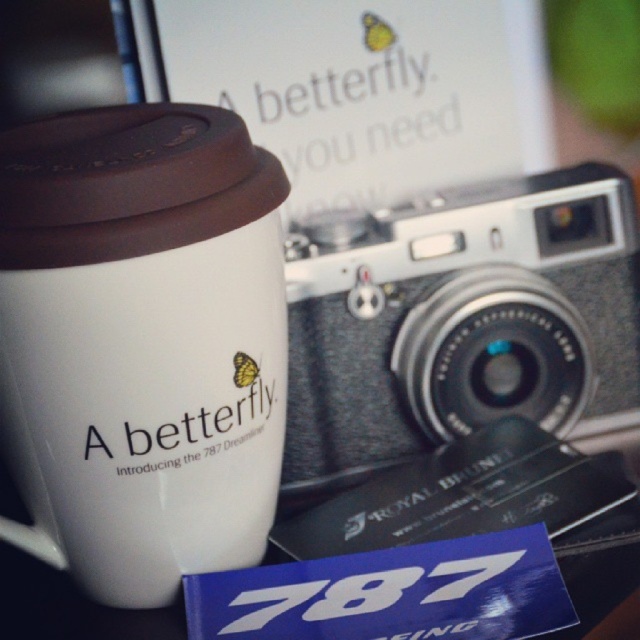
You are organizing items on a shelf and need to place both the white matte mug at left and the silver textured film camera at center. If the shelf has limited space, which item should you place first to ensure both fit?

The white matte mug at left has a smaller width than the silver textured film camera at center, so place the camera first to accommodate its larger size, then the mug will fit alongside it.

You are organizing items on a desk and need to place a new object at coordinate point 0.5, 0.2. Is there enough space between the white matte mug at left and the edge of the desk to place this new object there?

The white matte mug at left is located at point (141,342), which is very close to the desired coordinate (128,320). There may not be sufficient space between the mug and the desk edge to place the new object without overlapping.